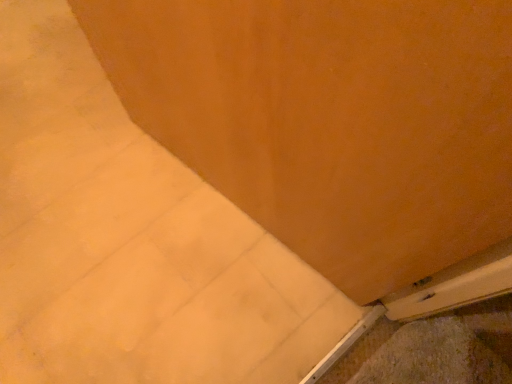
The image size is (512, 384). What do you see at coordinates (331, 120) in the screenshot? I see `matte wood door at upper right` at bounding box center [331, 120].

You are a GUI agent. You are given a task and a screenshot of the screen. Output one action in this format:
    pyautogui.click(x=<x>, y=<y>)
    Task: Click on the matte wood door at upper right
    Image resolution: width=512 pixels, height=384 pixels.
    Given the screenshot: What is the action you would take?
    [331, 120]

You are a GUI agent. You are given a task and a screenshot of the screen. Output one action in this format:
    pyautogui.click(x=<x>, y=<y>)
    Task: Click on the matte wood door at upper right
    
    Given the screenshot: What is the action you would take?
    pyautogui.click(x=331, y=120)